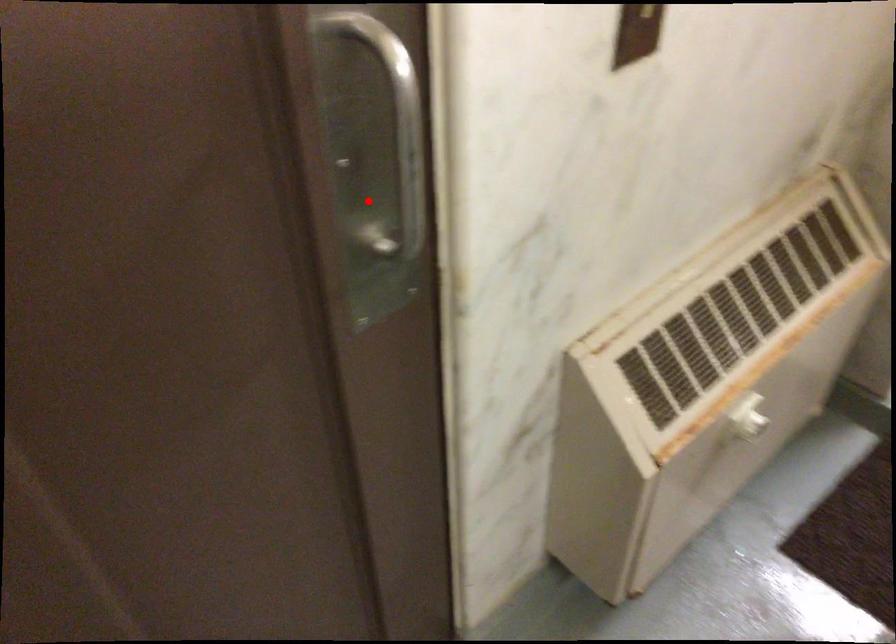
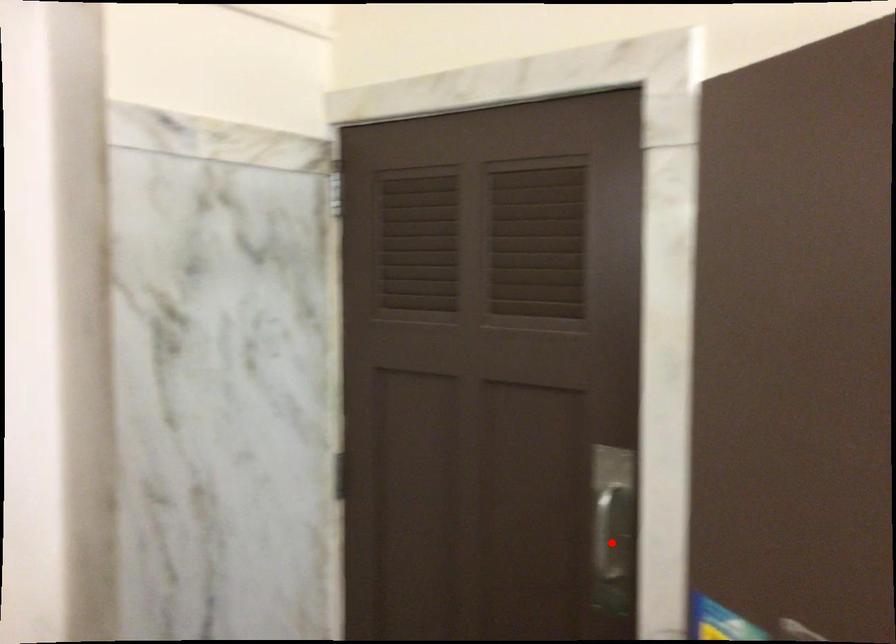
I am providing you with two images of the same scene from different viewpoints. A red point is marked on the first image and another point is marked on the second image. Is the red point in image1 aligned with the point shown in image2?

Yes